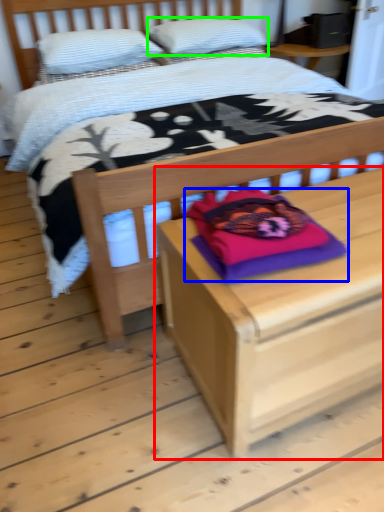
Question: Considering the real-world distances, which object is farthest from nightstand (highlighted by a red box)? pillow (highlighted by a blue box) or pillow (highlighted by a green box)?

Choices:
 (A) pillow
 (B) pillow

Answer: (B)